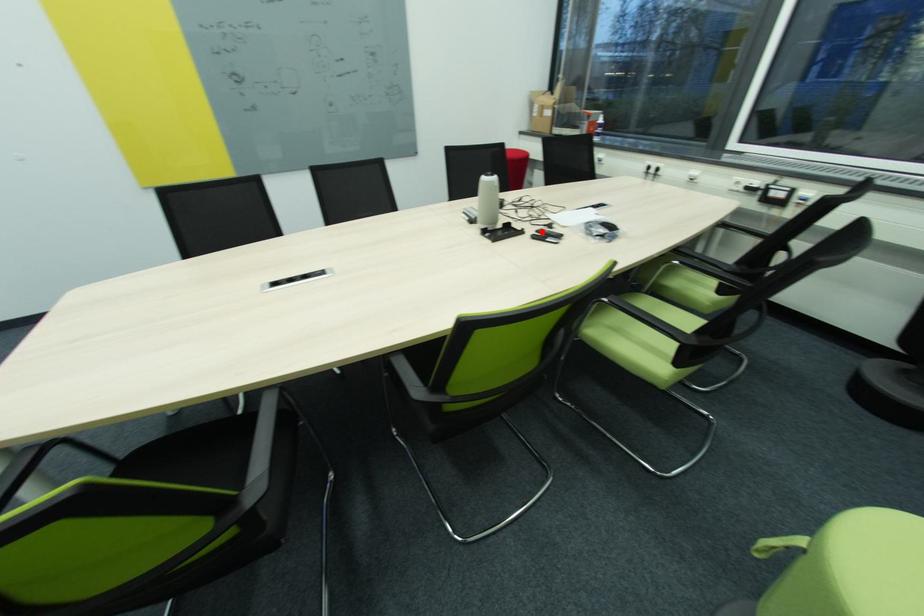
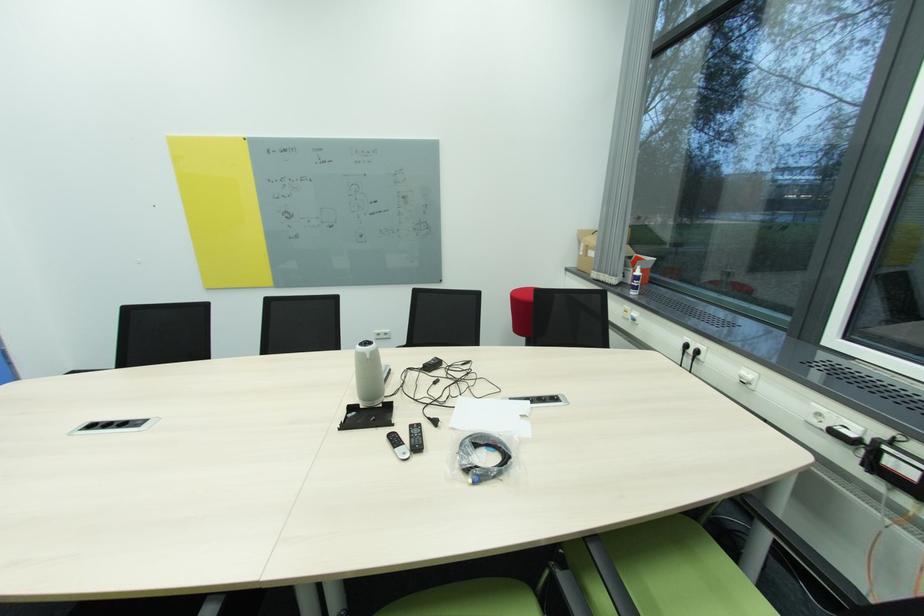
Where in the second image is the point corresponding to the highlighted location from the first image?

(416, 427)